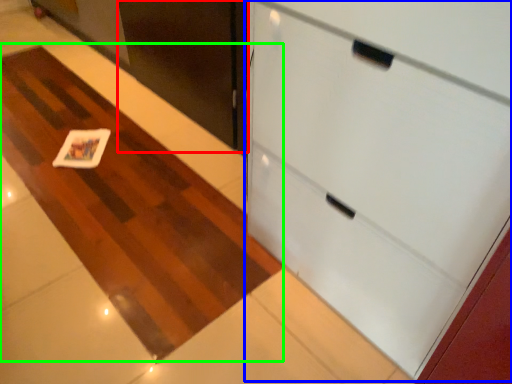
Question: Estimate the real-world distances between objects in this image. Which object is farther from door (highlighted by a red box), cabinetry (highlighted by a blue box) or plain (highlighted by a green box)?

Choices:
 (A) cabinetry
 (B) plain

Answer: (A)